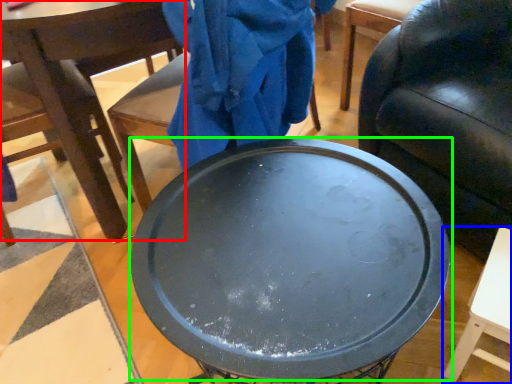
Question: Which object is the farthest from chair (highlighted by a red box)? Choose among these: table (highlighted by a blue box) or round table (highlighted by a green box).

Choices:
 (A) table
 (B) round table

Answer: (A)